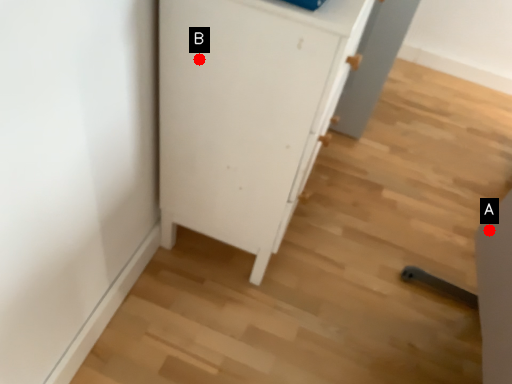
Question: Two points are circled on the image, labeled by A and B beside each circle. Which point appears farthest from the camera in this image?

Choices:
 (A) A is further
 (B) B is further

Answer: (A)